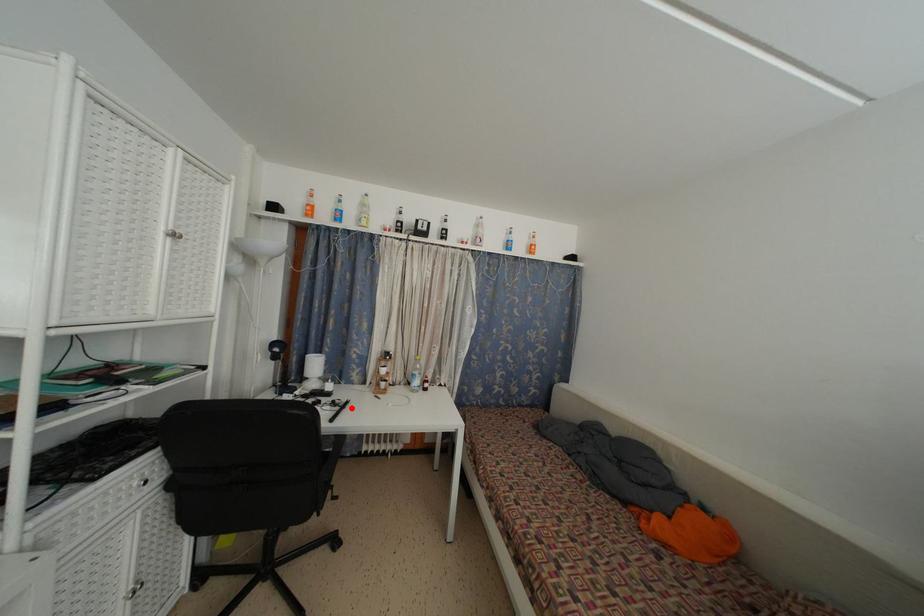
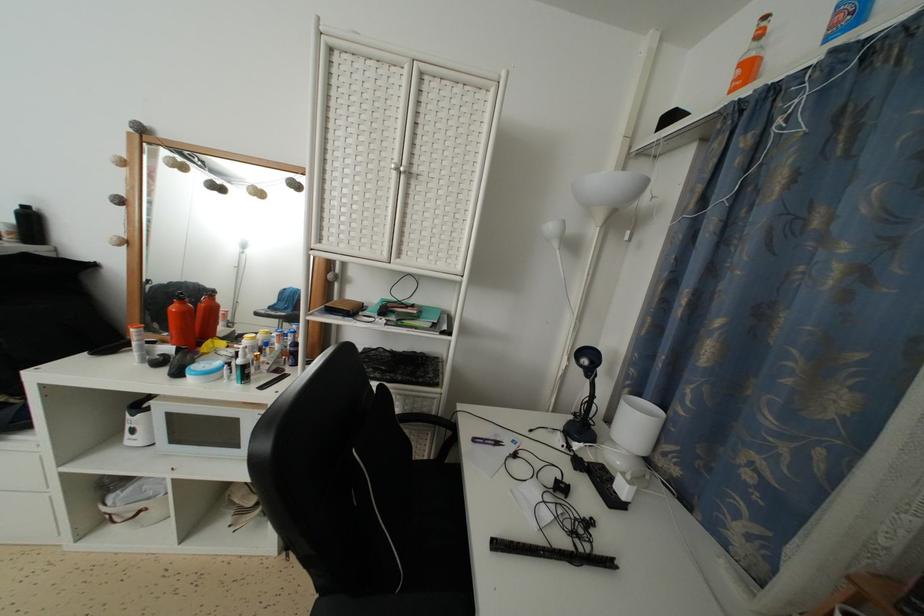
Where in the second image is the point corresponding to the highlighted location from the first image?

(614, 569)